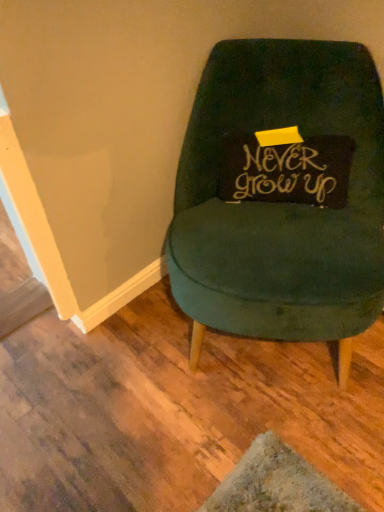
Question: Can you confirm if gold calligraphy pillow at center is bigger than velvet green chair at center?

Choices:
 (A) no
 (B) yes

Answer: (A)

Question: Does gold calligraphy pillow at center appear on the left side of velvet green chair at center?

Choices:
 (A) yes
 (B) no

Answer: (B)

Question: Can you confirm if gold calligraphy pillow at center is thinner than velvet green chair at center?

Choices:
 (A) yes
 (B) no

Answer: (A)

Question: Is gold calligraphy pillow at center positioned beyond the bounds of velvet green chair at center?

Choices:
 (A) no
 (B) yes

Answer: (A)

Question: From the image's perspective, is gold calligraphy pillow at center on top of velvet green chair at center?

Choices:
 (A) yes
 (B) no

Answer: (A)

Question: Is gold calligraphy pillow at center further to camera compared to velvet green chair at center?

Choices:
 (A) yes
 (B) no

Answer: (A)

Question: Is gold calligraphy pillow at center inside velvet green chair at center?

Choices:
 (A) no
 (B) yes

Answer: (B)

Question: Is velvet green chair at center positioned with its back to gold calligraphy pillow at center?

Choices:
 (A) no
 (B) yes

Answer: (B)

Question: Is the depth of velvet green chair at center less than that of gold calligraphy pillow at center?

Choices:
 (A) yes
 (B) no

Answer: (A)

Question: Is velvet green chair at center positioned far away from gold calligraphy pillow at center?

Choices:
 (A) yes
 (B) no

Answer: (B)

Question: Is velvet green chair at center bigger than gold calligraphy pillow at center?

Choices:
 (A) no
 (B) yes

Answer: (B)

Question: Are velvet green chair at center and gold calligraphy pillow at center beside each other?

Choices:
 (A) yes
 (B) no

Answer: (B)

Question: From the image's perspective, relative to gold calligraphy pillow at center, is velvet green chair at center above or below?

Choices:
 (A) above
 (B) below

Answer: (B)